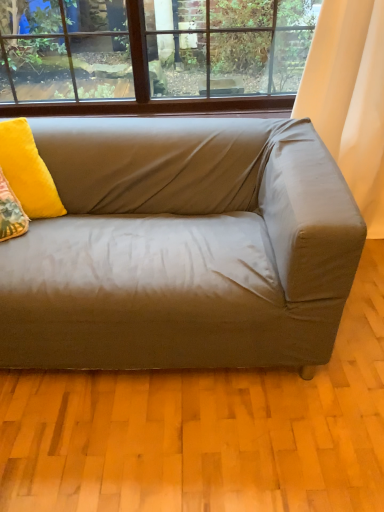
Question: Does satin beige couch at center have a larger size compared to velvet yellow pillow at upper left?

Choices:
 (A) no
 (B) yes

Answer: (B)

Question: Is satin beige couch at center positioned behind velvet yellow pillow at upper left?

Choices:
 (A) no
 (B) yes

Answer: (A)

Question: From a real-world perspective, is satin beige couch at center on velvet yellow pillow at upper left?

Choices:
 (A) no
 (B) yes

Answer: (A)

Question: Can you confirm if satin beige couch at center is thinner than velvet yellow pillow at upper left?

Choices:
 (A) yes
 (B) no

Answer: (B)

Question: Is satin beige couch at center not within velvet yellow pillow at upper left?

Choices:
 (A) no
 (B) yes

Answer: (B)

Question: Does point (23, 137) appear closer or farther from the camera than point (1, 327)?

Choices:
 (A) closer
 (B) farther

Answer: (B)

Question: Choose the correct answer: Is velvet yellow pillow at upper left inside satin beige couch at center or outside it?

Choices:
 (A) inside
 (B) outside

Answer: (A)

Question: From a real-world perspective, is velvet yellow pillow at upper left above or below satin beige couch at center?

Choices:
 (A) below
 (B) above

Answer: (B)

Question: Relative to satin beige couch at center, is velvet yellow pillow at upper left in front or behind?

Choices:
 (A) front
 (B) behind

Answer: (B)

Question: From a real-world perspective, is velvet yellow pillow at upper left positioned above or below white fabric curtain at right?

Choices:
 (A) below
 (B) above

Answer: (B)

Question: Is velvet yellow pillow at upper left in front of or behind white fabric curtain at right in the image?

Choices:
 (A) behind
 (B) front

Answer: (B)

Question: Considering the relative positions of velvet yellow pillow at upper left and white fabric curtain at right in the image provided, is velvet yellow pillow at upper left to the left or to the right of white fabric curtain at right?

Choices:
 (A) right
 (B) left

Answer: (B)

Question: In terms of width, does velvet yellow pillow at upper left look wider or thinner when compared to white fabric curtain at right?

Choices:
 (A) wide
 (B) thin

Answer: (A)

Question: Considering their positions, is white fabric curtain at right located in front of or behind velvet yellow pillow at upper left?

Choices:
 (A) behind
 (B) front

Answer: (A)

Question: From the image's perspective, is white fabric curtain at right positioned above or below velvet yellow pillow at upper left?

Choices:
 (A) above
 (B) below

Answer: (A)